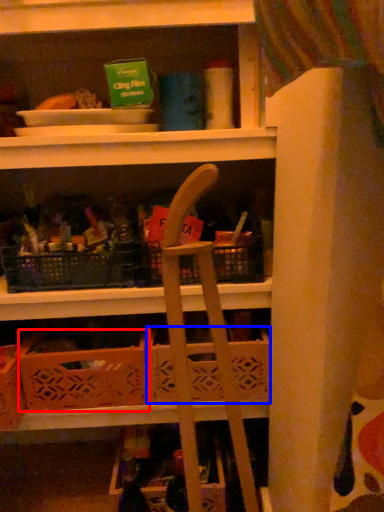
Question: Among these objects, which one is nearest to the camera, crate (highlighted by a red box) or basket (highlighted by a blue box)?

Choices:
 (A) crate
 (B) basket

Answer: (A)